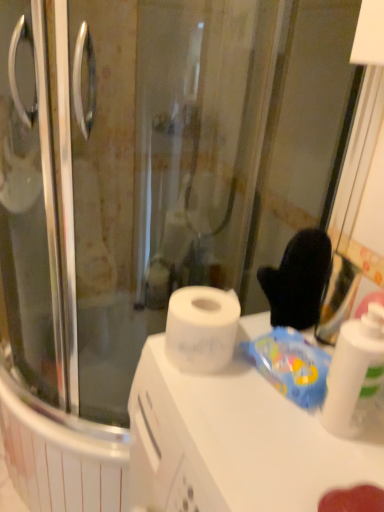
Question: Is the position of white matte counter top at center less distant than that of white glossy bottle at right?

Choices:
 (A) yes
 (B) no

Answer: (A)

Question: From a real-world perspective, is white matte counter top at center under white glossy bottle at right?

Choices:
 (A) no
 (B) yes

Answer: (B)

Question: From a real-world perspective, is white matte counter top at center located higher than white glossy bottle at right?

Choices:
 (A) no
 (B) yes

Answer: (A)

Question: Is white matte counter top at center outside of white glossy bottle at right?

Choices:
 (A) yes
 (B) no

Answer: (A)

Question: Is white matte counter top at center with white glossy bottle at right?

Choices:
 (A) no
 (B) yes

Answer: (A)

Question: Is white matte counter top at center thinner than white glossy bottle at right?

Choices:
 (A) yes
 (B) no

Answer: (B)

Question: Is white glossy bottle at right to the left of blue plastic bag at upper right from the viewer's perspective?

Choices:
 (A) yes
 (B) no

Answer: (B)

Question: Does white glossy bottle at right have a greater width compared to blue plastic bag at upper right?

Choices:
 (A) yes
 (B) no

Answer: (B)

Question: Can you confirm if white glossy bottle at right is bigger than blue plastic bag at upper right?

Choices:
 (A) yes
 (B) no

Answer: (A)

Question: From a real-world perspective, is white glossy bottle at right physically above blue plastic bag at upper right?

Choices:
 (A) no
 (B) yes

Answer: (B)

Question: Can you confirm if white glossy bottle at right is shorter than blue plastic bag at upper right?

Choices:
 (A) no
 (B) yes

Answer: (A)

Question: Considering the relative sizes of white glossy bottle at right and blue plastic bag at upper right in the image provided, is white glossy bottle at right taller than blue plastic bag at upper right?

Choices:
 (A) no
 (B) yes

Answer: (B)

Question: Is white glossy bottle at right looking in the opposite direction of white matte counter top at center?

Choices:
 (A) yes
 (B) no

Answer: (B)